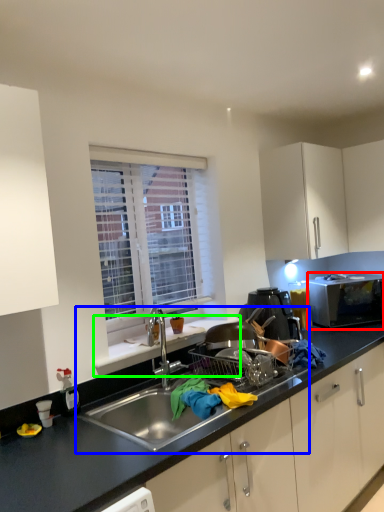
Question: Which object is positioned farthest from microwave oven (highlighted by a red box)? Select from sink (highlighted by a blue box) and window sill (highlighted by a green box).

Choices:
 (A) sink
 (B) window sill

Answer: (A)